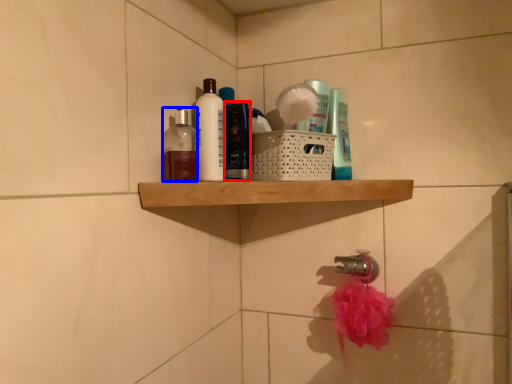
Question: Which point is closer to the camera, toiletry (highlighted by a red box) or toiletry (highlighted by a blue box)?

Choices:
 (A) toiletry
 (B) toiletry

Answer: (B)